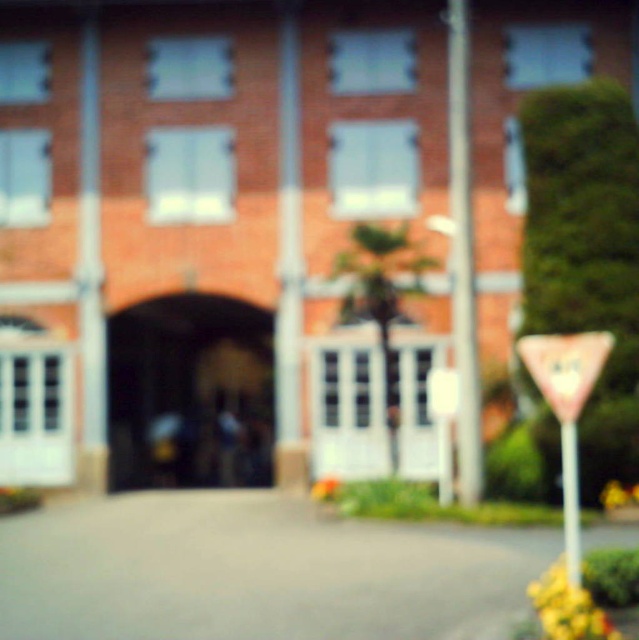
Which is more to the right, metallic pole at center or white plastic pole at right?

Positioned to the right is white plastic pole at right.

Does point (468, 225) come in front of point (571, 432)?

No, (468, 225) is further to viewer.

At what (x,y) coordinates should I click in order to perform the action: click on metallic pole at center. Please return your answer as a coordinate pair (x, y). Looking at the image, I should click on (463, 256).

Which is behind, point (606, 355) or point (576, 476)?

Point (576, 476)

Can you confirm if pink paper stop sign at right is positioned above white plastic pole at right?

Yes, pink paper stop sign at right is above white plastic pole at right.

Locate an element on the screen. pink paper stop sign at right is located at coordinates (x=566, y=368).

Between metallic pole at center and pink plastic triangle at lower right, which one has more height?

metallic pole at center

Is metallic pole at center to the left of pink plastic triangle at lower right from the viewer's perspective?

Correct, you'll find metallic pole at center to the left of pink plastic triangle at lower right.

Find the location of a particular element. This screenshot has height=640, width=639. metallic pole at center is located at coordinates (463, 256).

The image size is (639, 640). What are the coordinates of `metallic pole at center` in the screenshot? It's located at (463, 256).